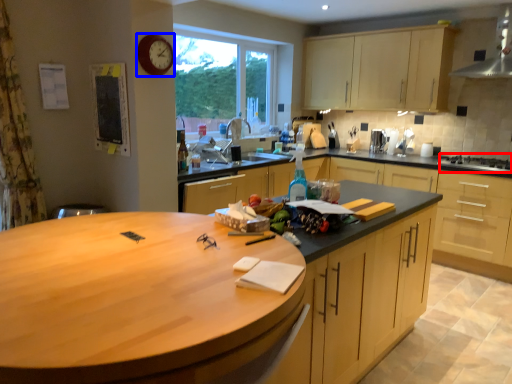
Question: Which object appears closest to the camera in this image, gas stove (highlighted by a red box) or clock (highlighted by a blue box)?

Choices:
 (A) gas stove
 (B) clock

Answer: (B)